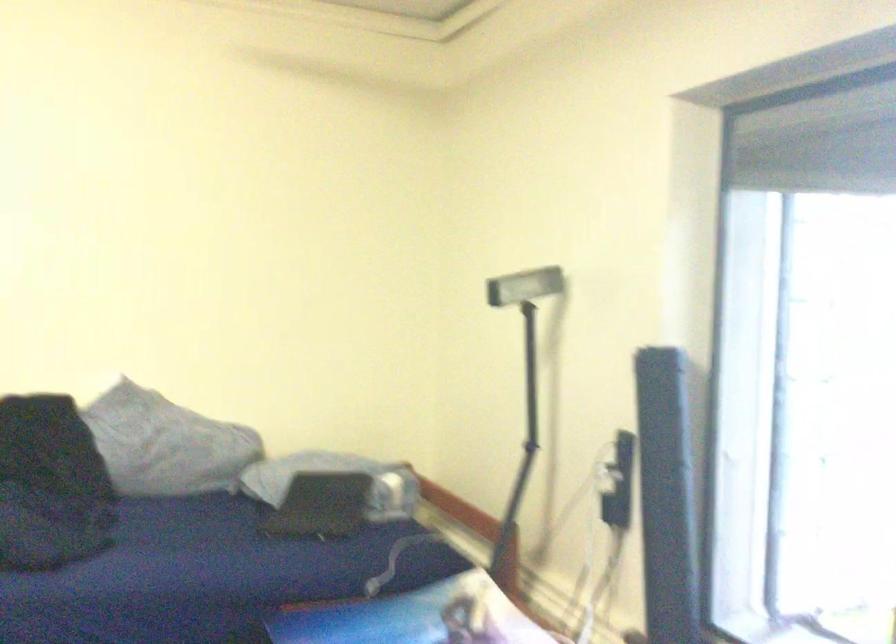
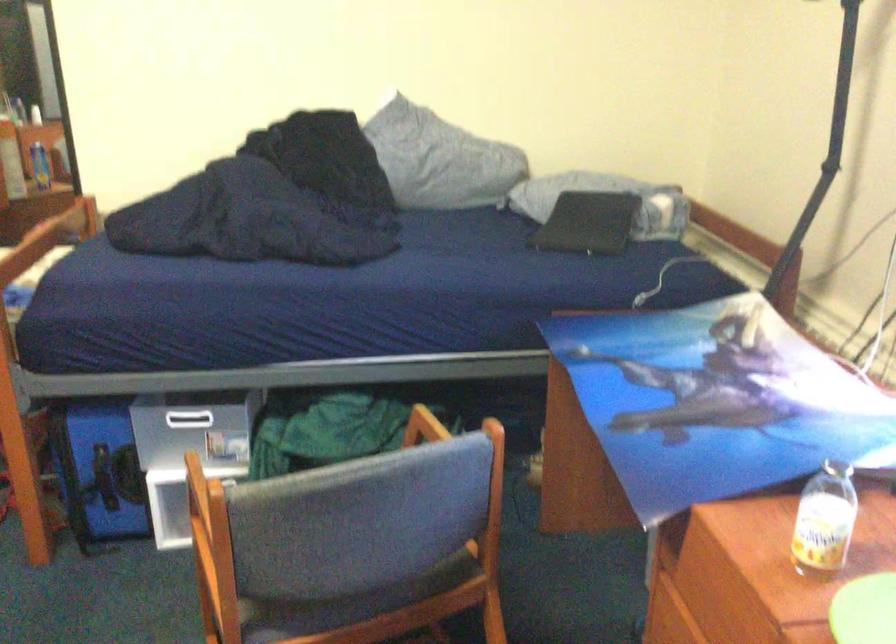
The first image is from the beginning of the video and the second image is from the end. How did the camera likely rotate when shooting the video?

The camera rotated toward left-down.